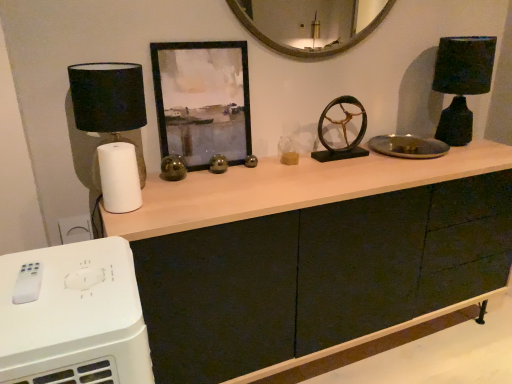
I want to click on vacant space that's between matte black lampshade at left, which appears as the 1th table lamp when viewed from the front, and black matte picture frame at center, so click(x=189, y=182).